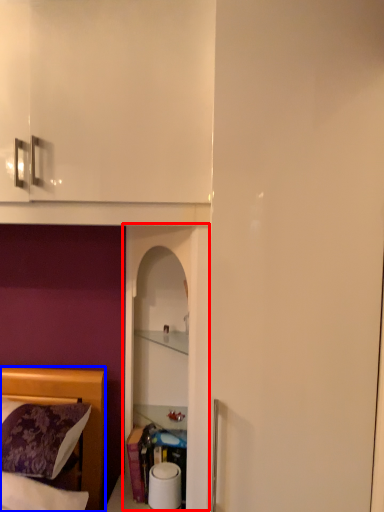
Question: Which object appears closest to the camera in this image, glass door (highlighted by a red box) or bed (highlighted by a blue box)?

Choices:
 (A) glass door
 (B) bed

Answer: (B)